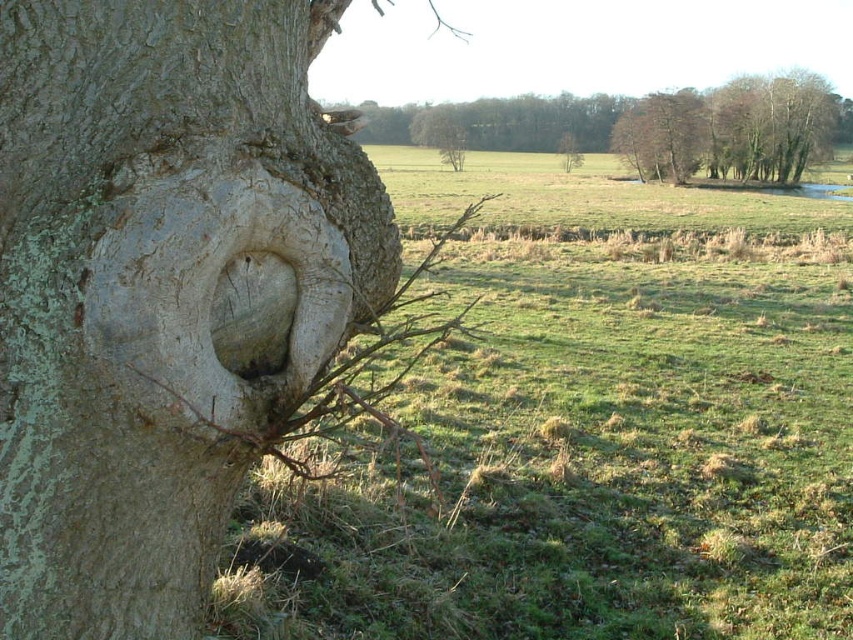
Is smooth bark tree at upper right taller than green rough bark tree at center?

Indeed, smooth bark tree at upper right has a greater height compared to green rough bark tree at center.

Where is `smooth bark tree at upper right`? smooth bark tree at upper right is located at coordinates (730, 129).

Does point (648, 147) come in front of point (569, 148)?

Yes, it is in front of point (569, 148).

Locate an element on the screen. smooth bark tree at upper right is located at coordinates [x=730, y=129].

Is smooth bark branch at center smaller than green rough bark tree at center?

No, smooth bark branch at center is not smaller than green rough bark tree at center.

Does smooth bark branch at center come behind green rough bark tree at center?

That is False.

The width and height of the screenshot is (853, 640). I want to click on smooth bark branch at center, so click(341, 376).

At what (x,y) coordinates should I click in order to perform the action: click on smooth bark branch at center. Please return your answer as a coordinate pair (x, y). Looking at the image, I should click on (341, 376).

Is point (556, 452) positioned before point (776, 144)?

Yes, point (556, 452) is in front of point (776, 144).

Which is more to the left, green grass at left or smooth bark tree at upper right?

green grass at left is more to the left.

Between point (636, 218) and point (807, 147), which one is positioned in front?

Positioned in front is point (636, 218).

The width and height of the screenshot is (853, 640). What are the coordinates of `green grass at left` in the screenshot? It's located at (589, 429).